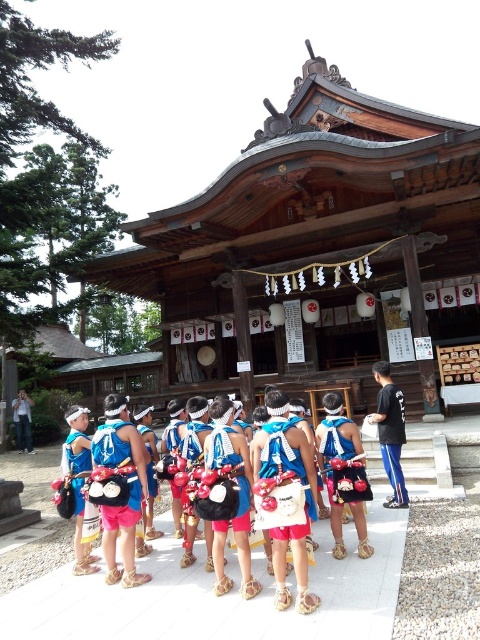
The height and width of the screenshot is (640, 480). Find the location of `blue fabric sash at center`. blue fabric sash at center is located at coordinates (389, 433).

Is the position of blue fabric sash at center more distant than that of denim jacket at lower left?

That is False.

This screenshot has width=480, height=640. Describe the element at coordinates (389, 433) in the screenshot. I see `blue fabric sash at center` at that location.

The width and height of the screenshot is (480, 640). In order to click on blue fabric sash at center in this screenshot , I will do (x=389, y=433).